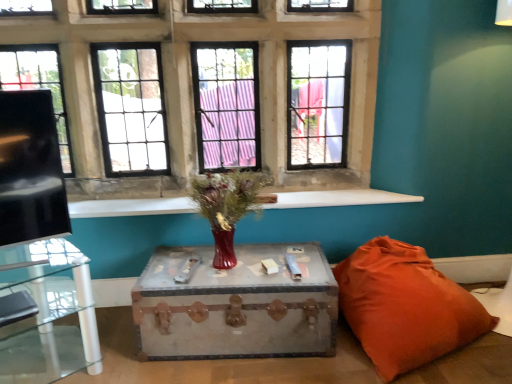
This screenshot has width=512, height=384. What do you see at coordinates (405, 306) in the screenshot?
I see `orange fabric pillow at lower right` at bounding box center [405, 306].

The image size is (512, 384). What are the coordinates of `clear glass table at left, the 2th table when ordered from right to left` in the screenshot? It's located at (48, 314).

What do you see at coordinates (236, 305) in the screenshot?
I see `rustic metal trunk at center, positioned as the 2th table in left-to-right order` at bounding box center [236, 305].

Describe the element at coordinates (192, 85) in the screenshot. The image size is (512, 384). I see `matte glass window at center` at that location.

In order to click on orange fabric pillow at lower right in this screenshot , I will do `click(405, 306)`.

Does point (474, 325) lie in front of point (190, 256)?

That is True.

Would you say orange fabric pillow at lower right is inside or outside rustic metal trunk at center, the 1th table in the right-to-left sequence?

orange fabric pillow at lower right is not enclosed by rustic metal trunk at center, the 1th table in the right-to-left sequence.

At what (x,y) coordinates should I click in order to perform the action: click on pillow on the right of rustic metal trunk at center, positioned as the 2th table in left-to-right order. Please return your answer as a coordinate pair (x, y). Looking at the image, I should click on pos(405,306).

From a real-world perspective, which is physically above, orange fabric pillow at lower right or rustic metal trunk at center, positioned as the 2th table in left-to-right order?

orange fabric pillow at lower right.

Who is shorter, white marble window sill at center or rustic metal trunk at center, positioned as the 2th table in left-to-right order?

white marble window sill at center is shorter.

From the image's perspective, is white marble window sill at center located beneath rustic metal trunk at center, positioned as the 2th table in left-to-right order?

No, from the image's perspective, white marble window sill at center is not below rustic metal trunk at center, positioned as the 2th table in left-to-right order.

Is white marble window sill at center further to the viewer compared to rustic metal trunk at center, the 1th table in the right-to-left sequence?

That is True.

Is white marble window sill at center oriented towards rustic metal trunk at center, positioned as the 2th table in left-to-right order?

No.

Is matte glass vase at center placed right next to clear glass table at left, the 2th table when ordered from right to left?

No.

Is matte glass vase at center taller than clear glass table at left, which is counted as the first table, starting from the left?

No, matte glass vase at center is not taller than clear glass table at left, which is counted as the first table, starting from the left.

Where is `houseplant above the clear glass table at left, which is counted as the first table, starting from the left (from a real-world perspective)`? The image size is (512, 384). houseplant above the clear glass table at left, which is counted as the first table, starting from the left (from a real-world perspective) is located at coordinates (226, 206).

How far apart are matte glass vase at center and clear glass table at left, which is counted as the first table, starting from the left?

matte glass vase at center is 76.82 centimeters from clear glass table at left, which is counted as the first table, starting from the left.

From a real-world perspective, is clear glass table at left, the 2th table when ordered from right to left, positioned above or below matte glass vase at center?

clear glass table at left, the 2th table when ordered from right to left, is situated lower than matte glass vase at center in the real world.

Is clear glass table at left, which is counted as the first table, starting from the left, not near matte glass vase at center?

No, clear glass table at left, which is counted as the first table, starting from the left, is not far from matte glass vase at center.

Between point (49, 352) and point (239, 190), which one is positioned behind?

The point (239, 190) is farther.

Does clear glass table at left, the 2th table when ordered from right to left, turn towards matte glass vase at center?

No, clear glass table at left, the 2th table when ordered from right to left, is not oriented towards matte glass vase at center.

Identify the location of pillow beneath the clear glass table at left, which is counted as the first table, starting from the left (from a real-world perspective). [x=405, y=306].

Considering their positions, is clear glass table at left, the 2th table when ordered from right to left, located in front of or behind orange fabric pillow at lower right?

Clearly, clear glass table at left, the 2th table when ordered from right to left, is in front of orange fabric pillow at lower right.

Who is shorter, clear glass table at left, which is counted as the first table, starting from the left, or orange fabric pillow at lower right?

orange fabric pillow at lower right.

Consider the image. From the image's perspective, would you say white marble window sill at center is positioned over matte glass vase at center?

Correct, white marble window sill at center appears higher than matte glass vase at center in the image.

From a real-world perspective, is white marble window sill at center above or below matte glass vase at center?

In terms of real-world spatial position, white marble window sill at center is below matte glass vase at center.

Would you say matte glass vase at center is part of white marble window sill at center's contents?

No, white marble window sill at center does not contain matte glass vase at center.

Is white marble window sill at center positioned with its back to matte glass vase at center?

That's not correct — white marble window sill at center is not looking away from matte glass vase at center.

Is rustic metal trunk at center, positioned as the 2th table in left-to-right order, placed right next to matte glass window at center?

No.

From the picture: Is rustic metal trunk at center, positioned as the 2th table in left-to-right order, wider than matte glass window at center?

Yes.

Considering the positions of objects rustic metal trunk at center, positioned as the 2th table in left-to-right order, and matte glass window at center in the image provided, who is behind, rustic metal trunk at center, positioned as the 2th table in left-to-right order, or matte glass window at center?

matte glass window at center is behind.

Considering the relative sizes of rustic metal trunk at center, positioned as the 2th table in left-to-right order, and matte glass window at center in the image provided, is rustic metal trunk at center, positioned as the 2th table in left-to-right order, smaller than matte glass window at center?

Yes.

The image size is (512, 384). What are the coordinates of `table beneath the orange fabric pillow at lower right (from a real-world perspective)` in the screenshot? It's located at (236, 305).

Identify the location of table that is the 2nd one when counting downward from the white marble window sill at center (from the image's perspective). This screenshot has height=384, width=512. (236, 305).

Looking at this image, looking at the image, which one is located further to rustic metal trunk at center, the 1th table in the right-to-left sequence, matte glass vase at center or white marble window sill at center?

white marble window sill at center is positioned further to the anchor rustic metal trunk at center, the 1th table in the right-to-left sequence.

Considering their positions, is orange fabric pillow at lower right positioned closer to matte glass window at center than clear glass table at left, the 2th table when ordered from right to left?

Based on the image, orange fabric pillow at lower right appears to be nearer to matte glass window at center.

From the image, which object appears to be farther from matte glass window at center, white marble window sill at center or matte glass vase at center?

Based on the image, white marble window sill at center appears to be further to matte glass window at center.

Which object lies further to the anchor point matte glass window at center, white marble window sill at center or rustic metal trunk at center, positioned as the 2th table in left-to-right order?

rustic metal trunk at center, positioned as the 2th table in left-to-right order, lies further to matte glass window at center than the other object.

Considering their positions, is matte glass vase at center positioned closer to orange fabric pillow at lower right than matte glass window at center?

Among the two, matte glass vase at center is located nearer to orange fabric pillow at lower right.

Based on their spatial positions, is white marble window sill at center or matte glass window at center further from clear glass table at left, the 2th table when ordered from right to left?

matte glass window at center.

Considering their positions, is rustic metal trunk at center, the 1th table in the right-to-left sequence, positioned closer to matte glass vase at center than orange fabric pillow at lower right?

Among the two, rustic metal trunk at center, the 1th table in the right-to-left sequence, is located nearer to matte glass vase at center.

When comparing their distances from rustic metal trunk at center, the 1th table in the right-to-left sequence, does matte glass vase at center or clear glass table at left, which is counted as the first table, starting from the left, seem further?

The object further to rustic metal trunk at center, the 1th table in the right-to-left sequence, is clear glass table at left, which is counted as the first table, starting from the left.

Where is `table located between clear glass table at left, which is counted as the first table, starting from the left, and white marble window sill at center in the left-right direction`? The width and height of the screenshot is (512, 384). table located between clear glass table at left, which is counted as the first table, starting from the left, and white marble window sill at center in the left-right direction is located at coordinates (236, 305).

Where is `table between clear glass table at left, the 2th table when ordered from right to left, and orange fabric pillow at lower right`? This screenshot has width=512, height=384. table between clear glass table at left, the 2th table when ordered from right to left, and orange fabric pillow at lower right is located at coordinates (236, 305).

Find the location of a particular element. houseplant between clear glass table at left, the 2th table when ordered from right to left, and orange fabric pillow at lower right from left to right is located at coordinates (226, 206).

This screenshot has height=384, width=512. I want to click on houseplant between clear glass table at left, the 2th table when ordered from right to left, and white marble window sill at center from left to right, so click(226, 206).